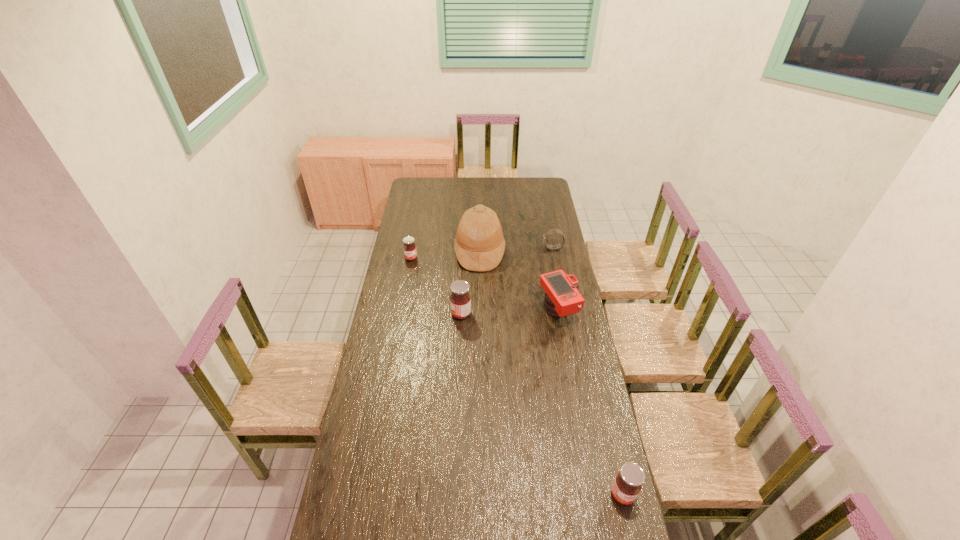
This screenshot has width=960, height=540. In order to click on jam positioned at the right edge in this screenshot , I will do `click(627, 484)`.

Where is `watch positioned at the right edge`? watch positioned at the right edge is located at coordinates (552, 231).

Image resolution: width=960 pixels, height=540 pixels. In order to click on camera located at the right edge in this screenshot , I will do tap(562, 299).

The image size is (960, 540). I want to click on object present at the near right corner, so click(x=627, y=484).

You are a GUI agent. You are given a task and a screenshot of the screen. Output one action in this format:
    pyautogui.click(x=<x>, y=<y>)
    Task: Click on the blank space at the far edge
    This screenshot has height=540, width=960.
    Given the screenshot: What is the action you would take?
    pyautogui.click(x=484, y=182)

This screenshot has width=960, height=540. What are the coordinates of `free region at the near edge of the desktop` in the screenshot? It's located at (486, 511).

Find the location of `vacant space at the left edge`. vacant space at the left edge is located at coordinates (397, 406).

Where is `vacant region at the right edge of the desktop`? The width and height of the screenshot is (960, 540). vacant region at the right edge of the desktop is located at coordinates (569, 330).

Locate an element on the screen. The image size is (960, 540). free point at the far right corner is located at coordinates (544, 183).

What are the coordinates of `vacant space at the near right corner of the desktop` in the screenshot? It's located at (578, 521).